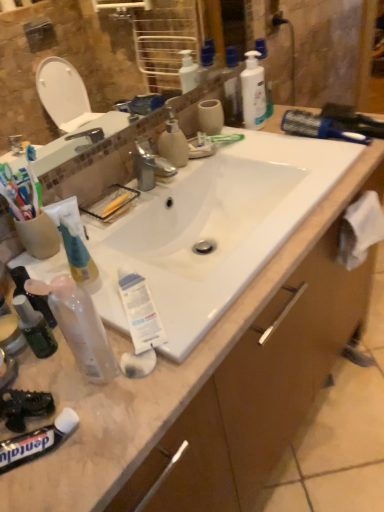
Question: Should I look upward or downward to see translucent plastic mouthwash at lower left?

Choices:
 (A) up
 (B) down

Answer: (B)

Question: Which direction should I rotate to look at matte plastic soap dispenser at center, the 2th cleaning product when ordered from right to left?

Choices:
 (A) right
 (B) left

Answer: (B)

Question: Is translucent plastic bottles at upper center, marked as the first toiletry in a top-to-bottom arrangement, next to brown wood drawer at lower right?

Choices:
 (A) no
 (B) yes

Answer: (A)

Question: Considering the relative sizes of translucent plastic bottles at upper center, acting as the 2th toiletry starting from the front, and brown wood drawer at lower right in the image provided, is translucent plastic bottles at upper center, acting as the 2th toiletry starting from the front, shorter than brown wood drawer at lower right?

Choices:
 (A) no
 (B) yes

Answer: (A)

Question: Can you confirm if translucent plastic bottles at upper center, acting as the 2th toiletry starting from the front, is smaller than brown wood drawer at lower right?

Choices:
 (A) yes
 (B) no

Answer: (A)

Question: Does translucent plastic bottles at upper center, which is the 1th toiletry from back to front, have a lesser width compared to brown wood drawer at lower right?

Choices:
 (A) yes
 (B) no

Answer: (A)

Question: Is translucent plastic bottles at upper center, the second toiletry from the bottom, far away from brown wood drawer at lower right?

Choices:
 (A) yes
 (B) no

Answer: (A)

Question: Is translucent plastic bottles at upper center, marked as the first toiletry in a top-to-bottom arrangement, bigger than brown wood drawer at lower right?

Choices:
 (A) yes
 (B) no

Answer: (B)

Question: Considering the relative sizes of translucent plastic bottles at upper center, marked as the first toiletry in a top-to-bottom arrangement, and white glossy bottle at upper right, acting as the 2th cleaning product starting from the front, in the image provided, is translucent plastic bottles at upper center, marked as the first toiletry in a top-to-bottom arrangement, thinner than white glossy bottle at upper right, acting as the 2th cleaning product starting from the front,?

Choices:
 (A) no
 (B) yes

Answer: (A)

Question: Can you confirm if translucent plastic bottles at upper center, which is the 1th toiletry from back to front, is positioned to the left of white glossy bottle at upper right, positioned as the 2th cleaning product in bottom-to-top order?

Choices:
 (A) no
 (B) yes

Answer: (B)

Question: Can you confirm if translucent plastic bottles at upper center, which is the 1th toiletry from back to front, is smaller than white glossy bottle at upper right, the second cleaning product in the left-to-right sequence?

Choices:
 (A) no
 (B) yes

Answer: (B)

Question: From the image's perspective, is translucent plastic bottles at upper center, which is the 1th toiletry from back to front, beneath white glossy bottle at upper right, acting as the 2th cleaning product starting from the front?

Choices:
 (A) yes
 (B) no

Answer: (B)

Question: Can you confirm if translucent plastic bottles at upper center, acting as the 2th toiletry starting from the front, is taller than white glossy bottle at upper right, positioned as the first cleaning product in back-to-front order?

Choices:
 (A) no
 (B) yes

Answer: (B)

Question: From the image's perspective, is translucent plastic bottles at upper center, the 2th toiletry positioned from the left, located above white glossy bottle at upper right, the second cleaning product in the left-to-right sequence?

Choices:
 (A) no
 (B) yes

Answer: (B)

Question: Can you confirm if white glossy bottle at upper right, positioned as the 2th cleaning product in bottom-to-top order, is smaller than transparent plastic spray bottle at lower left, the 2th toiletry when ordered from right to left?

Choices:
 (A) yes
 (B) no

Answer: (B)